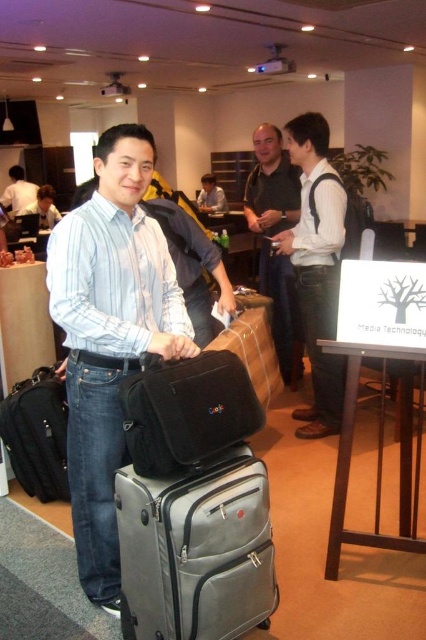
Question: Does gray fabric suitcase at center have a larger size compared to matte black briefcase at center?

Choices:
 (A) yes
 (B) no

Answer: (A)

Question: Which point appears farthest from the camera in this image?

Choices:
 (A) (6, 408)
 (B) (13, 173)
 (C) (201, 188)
 (D) (316, 346)

Answer: (C)

Question: Based on their relative distances, which object is farther from the matte black laptop at center?

Choices:
 (A) dark gray shirt at center
 (B) white matte shirt at upper left
 (C) matte black briefcase at center

Answer: (C)

Question: Which object is the closest to the matte blue shirt at center?

Choices:
 (A) white matte shirt at upper left
 (B) matte black shirt at upper left

Answer: (B)

Question: Is dark gray shirt at center to the right of matte black shirt at upper left from the viewer's perspective?

Choices:
 (A) yes
 (B) no

Answer: (A)

Question: Does gray fabric suitcase at center have a lesser width compared to black fabric bag at center?

Choices:
 (A) yes
 (B) no

Answer: (B)